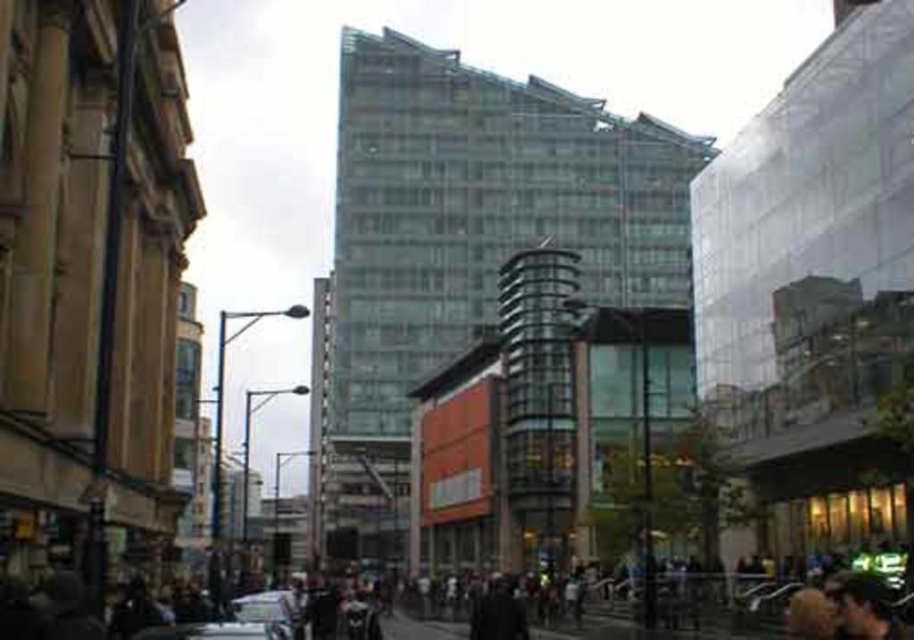
Which is below, metallic silver car at lower center or silver metallic car at lower center?

silver metallic car at lower center

Which is more to the left, metallic silver car at lower center or silver metallic car at lower center?

silver metallic car at lower center

Between point (243, 625) and point (292, 612), which one is positioned in front?

Positioned in front is point (243, 625).

At what (x,y) coordinates should I click in order to perform the action: click on metallic silver car at lower center. Please return your answer as a coordinate pair (x, y). The height and width of the screenshot is (640, 914). Looking at the image, I should click on pos(214,630).